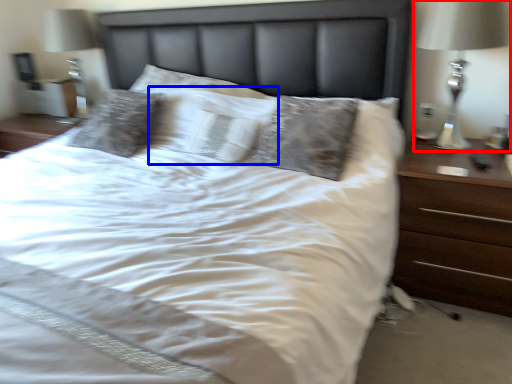
Question: Which of the following is the closest to the observer, bedside lamp (highlighted by a red box) or pillow (highlighted by a blue box)?

Choices:
 (A) bedside lamp
 (B) pillow

Answer: (A)